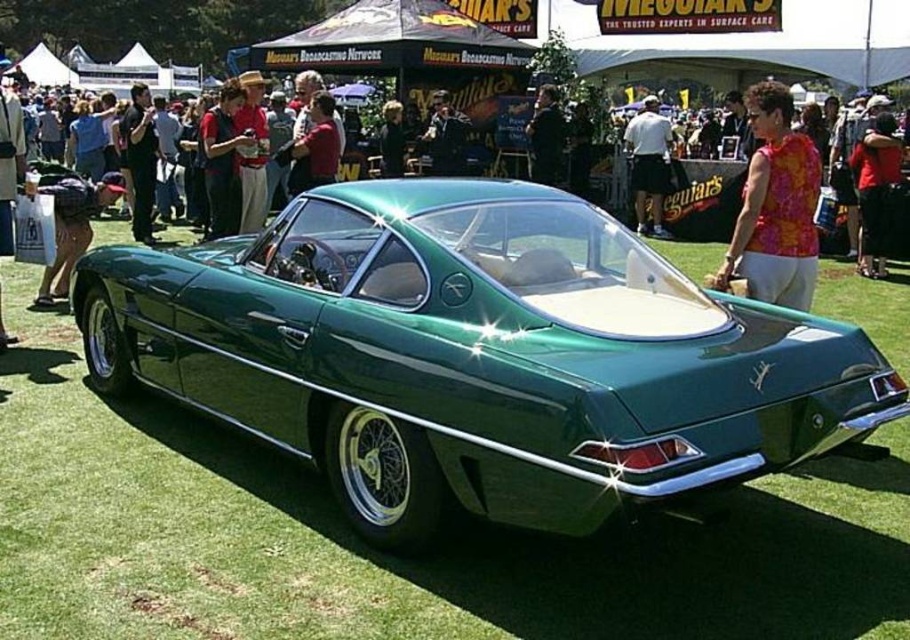
Does floral fabric blouse at center appear on the right side of matte black jacket at lower left?

Yes, floral fabric blouse at center is to the right of matte black jacket at lower left.

Can you confirm if floral fabric blouse at center is bigger than matte black jacket at lower left?

Actually, floral fabric blouse at center might be smaller than matte black jacket at lower left.

Does point (771, 250) lie behind point (87, 241)?

No.

At what (x,y) coordinates should I click in order to perform the action: click on floral fabric blouse at center. Please return your answer as a coordinate pair (x, y). Image resolution: width=910 pixels, height=640 pixels. Looking at the image, I should click on (775, 205).

Does floral fabric blouse at center have a larger size compared to red fabric shirt at upper right?

Actually, floral fabric blouse at center might be smaller than red fabric shirt at upper right.

Does floral fabric blouse at center appear on the right side of red fabric shirt at upper right?

In fact, floral fabric blouse at center is to the left of red fabric shirt at upper right.

Between point (811, 275) and point (887, 156), which one is positioned in front?

Point (811, 275)

Locate an element on the screen. The image size is (910, 640). floral fabric blouse at center is located at coordinates (775, 205).

How much distance is there between red fabric shirt at upper right and matte black jacket at lower left?

red fabric shirt at upper right and matte black jacket at lower left are 9.60 meters apart.

Which of these two, red fabric shirt at upper right or matte black jacket at lower left, stands shorter?

Standing shorter between the two is matte black jacket at lower left.

Which is in front, point (867, 157) or point (84, 196)?

Point (84, 196) is in front.

You are a GUI agent. You are given a task and a screenshot of the screen. Output one action in this format:
    pyautogui.click(x=<x>, y=<y>)
    Task: Click on the red fabric shirt at upper right
    This screenshot has height=640, width=910.
    Given the screenshot: What is the action you would take?
    pyautogui.click(x=875, y=189)